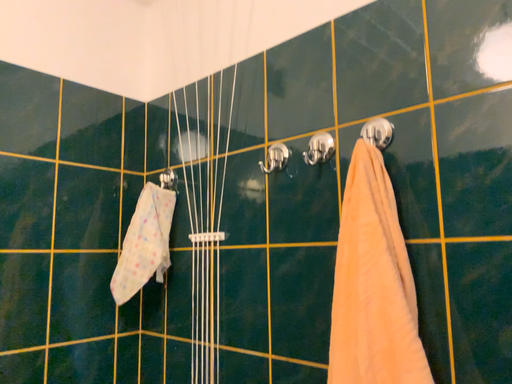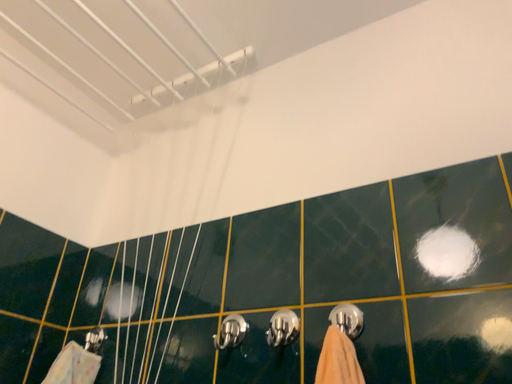
Question: Which way did the camera rotate in the video?

Choices:
 (A) rotated downward
 (B) rotated upward

Answer: (B)